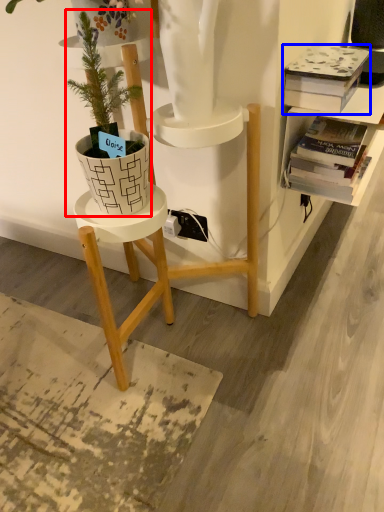
Question: Which point is further to the camera, houseplant (highlighted by a red box) or book (highlighted by a blue box)?

Choices:
 (A) houseplant
 (B) book

Answer: (B)